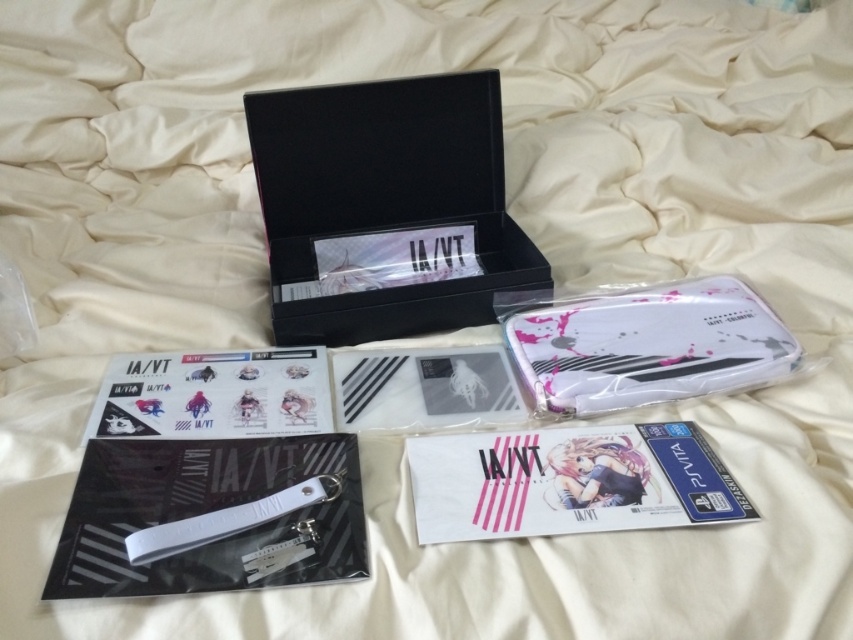
Question: Which point is farther from the camera taking this photo?

Choices:
 (A) (268, 432)
 (B) (502, 141)

Answer: (B)

Question: Which object is the closest to the white matte card game at center?

Choices:
 (A) white matte plastic case at center
 (B) black matte box at upper center
 (C) matte plastic card game at center left

Answer: (A)

Question: Based on their relative distances, which object is nearer to the matte plastic card game at center left?

Choices:
 (A) white matte plastic case at center
 (B) black matte box at upper center

Answer: (B)

Question: Is black matte box at upper center thinner than matte plastic card game at center left?

Choices:
 (A) yes
 (B) no

Answer: (B)

Question: Considering the relative positions of white matte plastic case at center and matte plastic card game at center left in the image provided, where is white matte plastic case at center located with respect to matte plastic card game at center left?

Choices:
 (A) above
 (B) below

Answer: (A)

Question: Is black matte box at upper center further to the viewer compared to white matte plastic case at center?

Choices:
 (A) no
 (B) yes

Answer: (B)